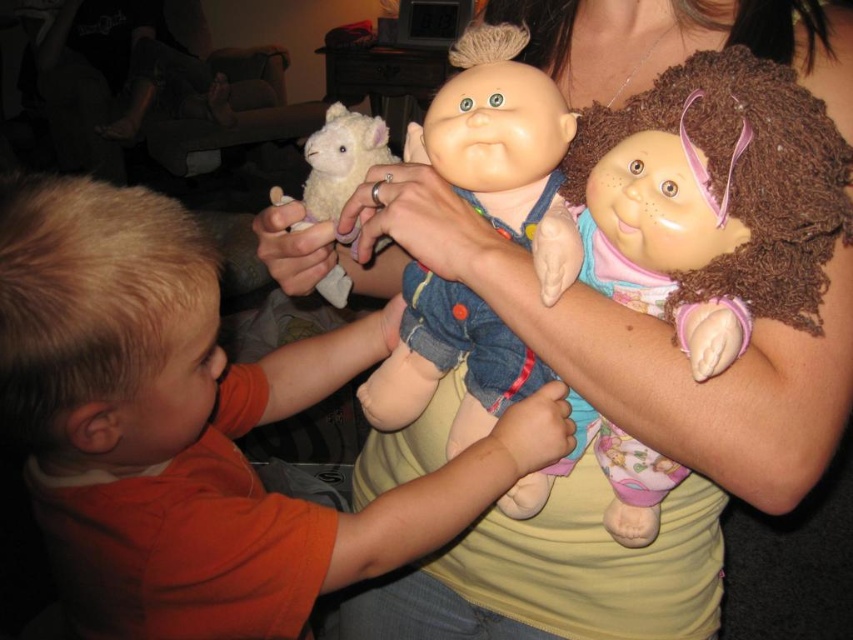
You are a parent trying to teach your child about spatial relationships. You point to two points in the image, one at point (776, 200) and the other at point (312, 161). Which point is closer to the child?

Point (776, 200) is in front of point (312, 161), so it is closer to the child.

Based on the photo, you are a toy designer observing the scene. The orange cotton shirt at left belongs to a child reaching for the smooth plastic doll at center. Can you determine if the child is closer to the doll than the woman holding it?

The orange cotton shirt at left is in front of the smooth plastic doll at center, meaning the child is closer to the doll than the woman holding it.